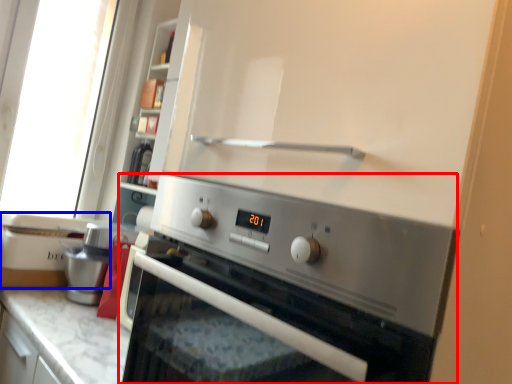
Question: Which object is closer to the camera taking this photo, home appliance (highlighted by a red box) or appliance (highlighted by a blue box)?

Choices:
 (A) home appliance
 (B) appliance

Answer: (A)